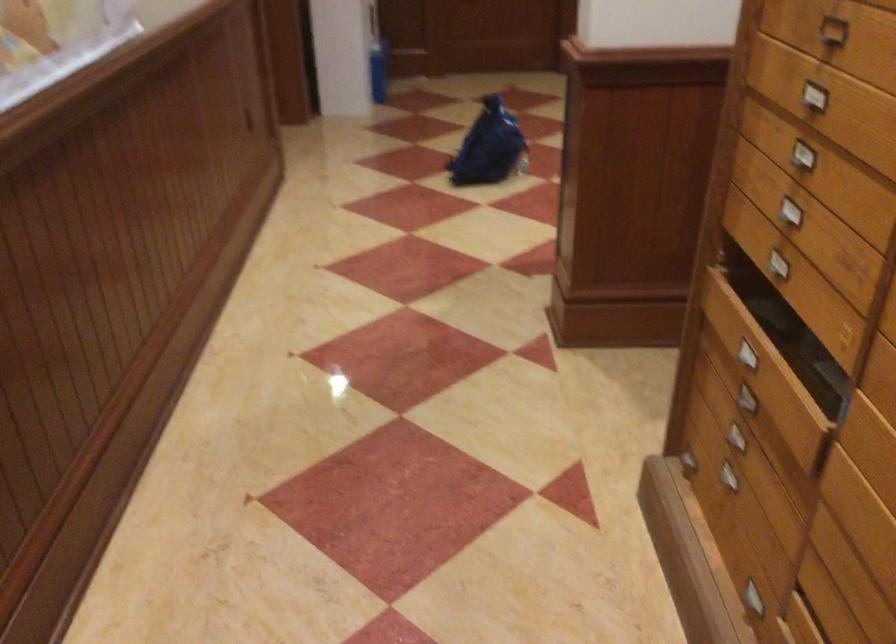
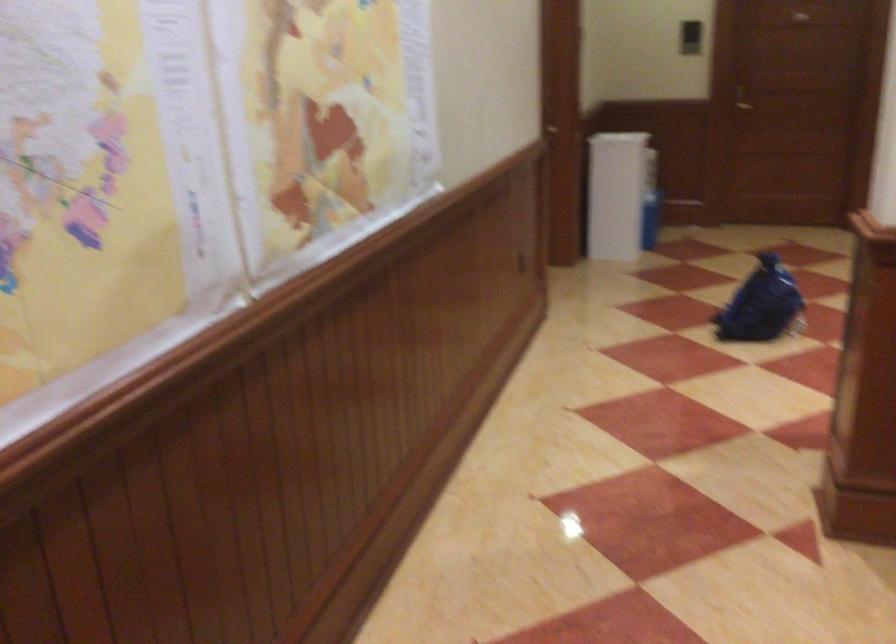
Question: The camera is either moving clockwise (left) or counter-clockwise (right) around the object. The first image is from the beginning of the video and the second image is from the end. Is the camera moving left or right when shooting the video?

Choices:
 (A) Left
 (B) Right

Answer: (B)